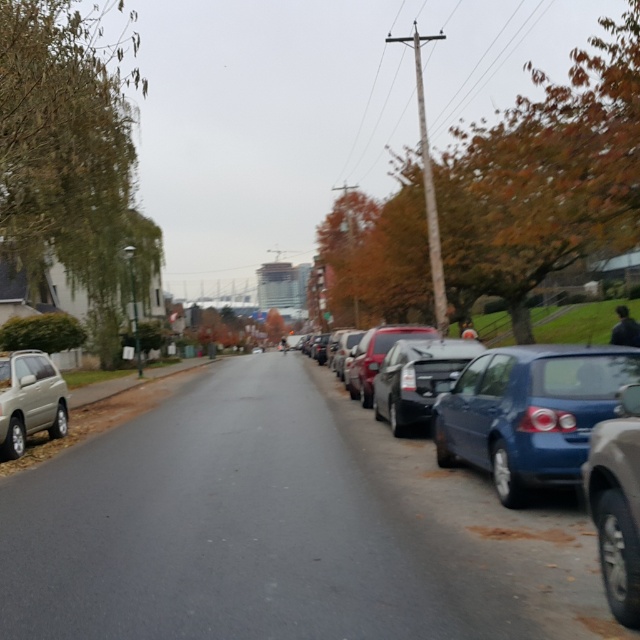
Question: Can you confirm if satin black sedan at right is smaller than matte beige suv at lower left?

Choices:
 (A) yes
 (B) no

Answer: (B)

Question: Which of the following is the closest to the observer?

Choices:
 (A) matte beige suv at lower left
 (B) satin black sedan at right
 (C) metallic blue sedan at right

Answer: (C)

Question: Which object is the closest to the matte beige suv at lower left?

Choices:
 (A) metallic blue sedan at right
 (B) satin black sedan at right

Answer: (A)

Question: Which point is farther to the camera?

Choices:
 (A) metallic blue sedan at right
 (B) satin black sedan at right

Answer: (B)

Question: Is metallic blue sedan at right to the left of matte beige suv at lower left from the viewer's perspective?

Choices:
 (A) no
 (B) yes

Answer: (A)

Question: From the image, what is the correct spatial relationship of metallic blue sedan at right in relation to satin black sedan at right?

Choices:
 (A) below
 (B) above

Answer: (A)